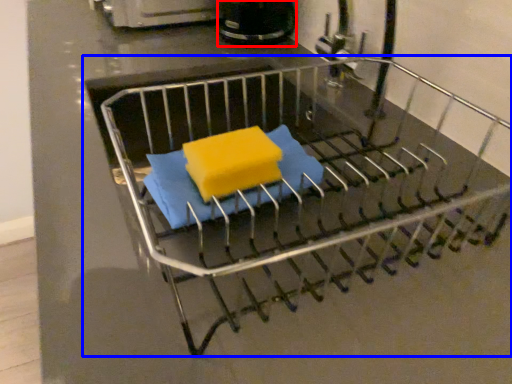
Question: Which of the following is the closest to the observer, appliance (highlighted by a red box) or furniture (highlighted by a blue box)?

Choices:
 (A) appliance
 (B) furniture

Answer: (B)